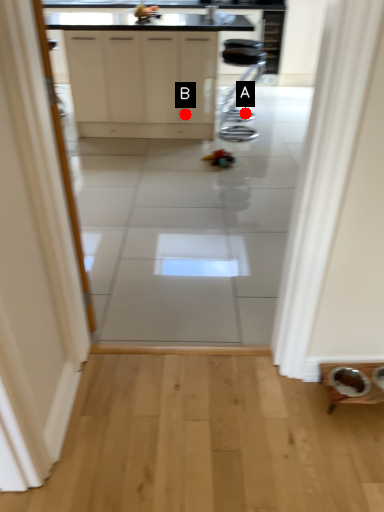
Question: Two points are circled on the image, labeled by A and B beside each circle. Which of the following is the closest to the observer?

Choices:
 (A) A is closer
 (B) B is closer

Answer: (B)